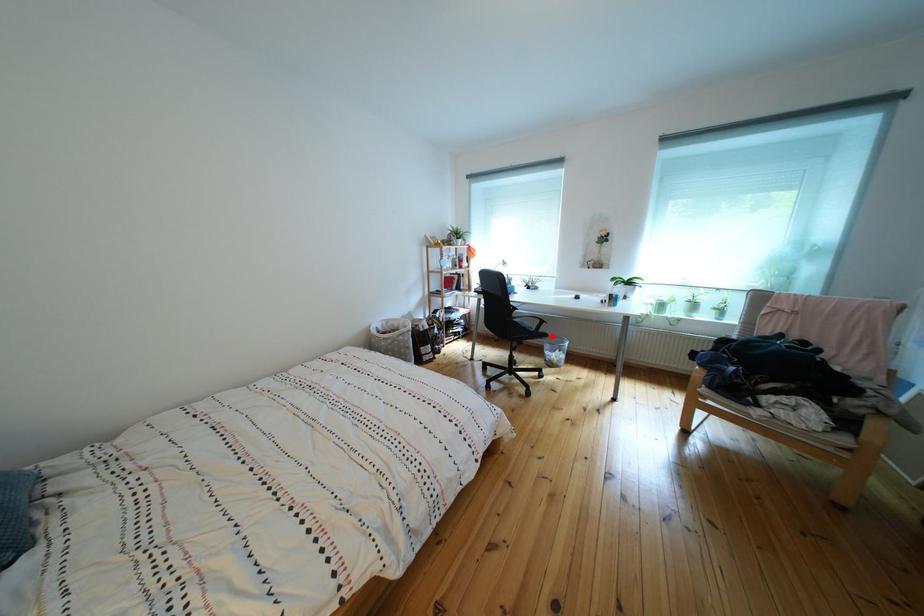
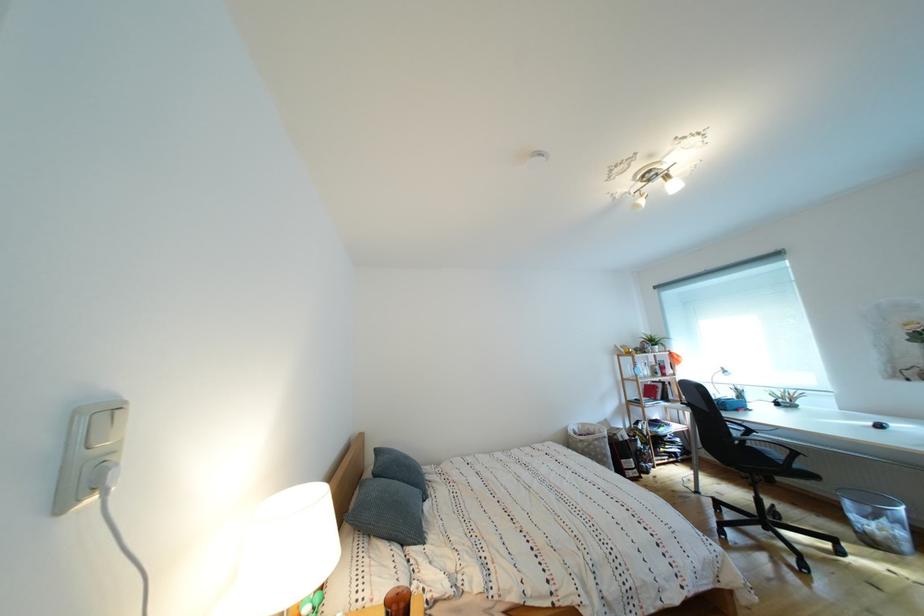
Question: I am providing you with two images of the same scene from different viewpoints. A red point is shown in image1. For the corresponding object point in image2, is it positioned nearer or farther from the camera?

Choices:
 (A) Nearer
 (B) Farther

Answer: (A)